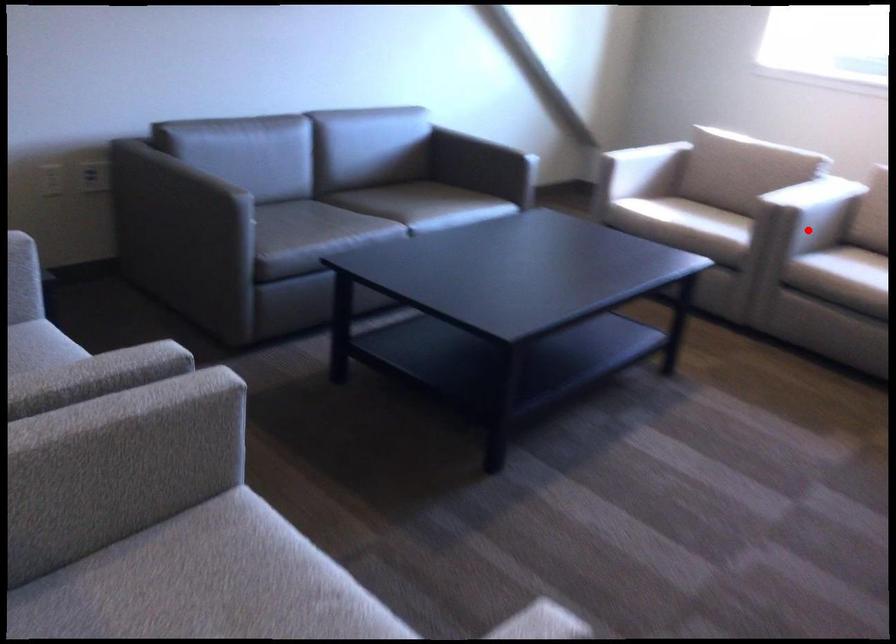
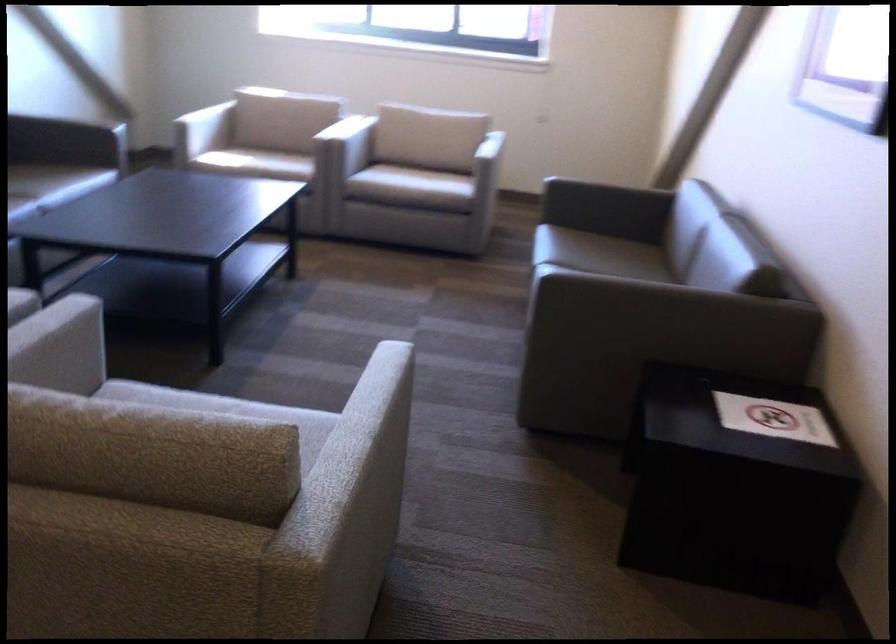
Question: I am providing you with two images of the same scene from different viewpoints. Image1 has a red point marked. In image2, the corresponding 3D location appears at what relative position? Reply with the corresponding letter.

Choices:
 (A) Closer
 (B) Farther

Answer: (B)